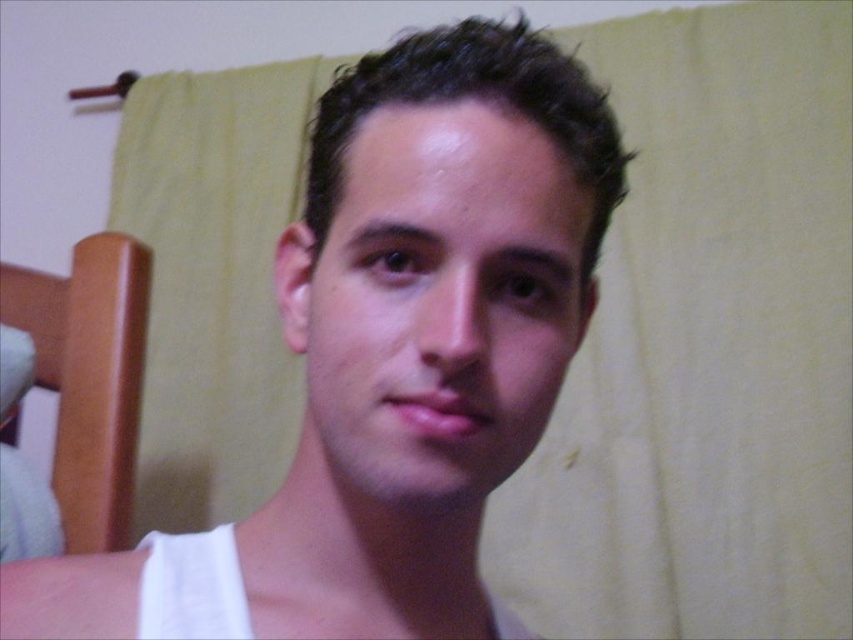
Which is in front, point (430, 452) or point (367, 406)?

Point (430, 452)

Is white matte tank top at center wider than smooth skin face at center?

Yes, white matte tank top at center is wider than smooth skin face at center.

From the picture: Who is more distant from viewer, (567,292) or (384,113)?

Positioned behind is point (567,292).

In order to click on white matte tank top at center in this screenshot , I will do `click(393, 355)`.